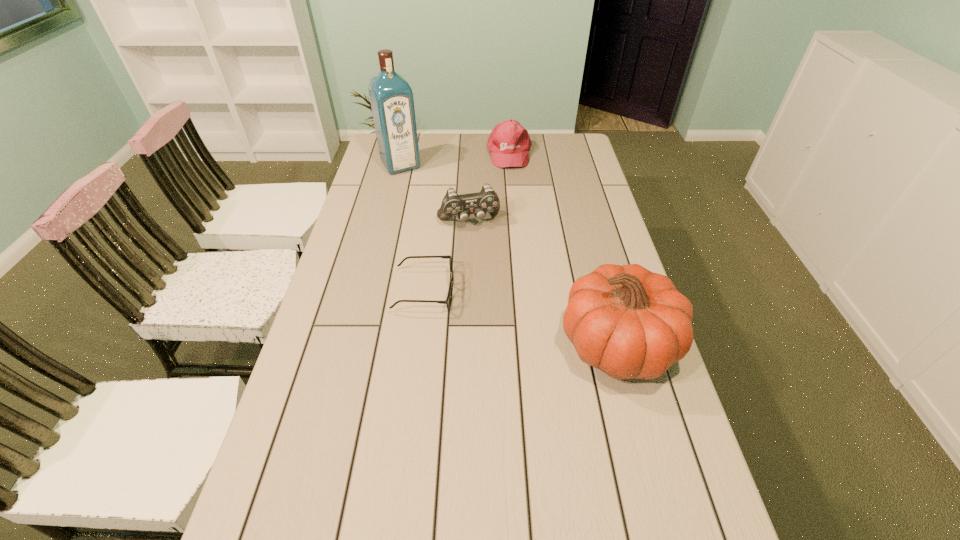
What are the coordinates of `vacant space located at the front of the baseball cap with the brim` in the screenshot? It's located at (522, 228).

Identify the location of free space located at the front of the baseball cap with the brim. The image size is (960, 540). (523, 235).

Where is `free location located on the surface of the control with buttons`? This screenshot has width=960, height=540. free location located on the surface of the control with buttons is located at coordinates click(x=490, y=274).

You are a GUI agent. You are given a task and a screenshot of the screen. Output one action in this format:
    pyautogui.click(x=<x>, y=<y>)
    Task: Click on the vacant region located on the surface of the control with buttons
    
    Given the screenshot: What is the action you would take?
    pyautogui.click(x=481, y=246)

Locate an element on the screen. The height and width of the screenshot is (540, 960). free space located 0.080m on the surface of the control with buttons is located at coordinates (481, 246).

Locate an element on the screen. This screenshot has height=540, width=960. liquor located at the far edge is located at coordinates (391, 97).

You are a GUI agent. You are given a task and a screenshot of the screen. Output one action in this format:
    pyautogui.click(x=<x>, y=<y>)
    Task: Click on the baseball cap that is at the far edge
    Image resolution: width=960 pixels, height=540 pixels.
    Given the screenshot: What is the action you would take?
    pyautogui.click(x=509, y=143)

Where is `object that is at the left edge`? This screenshot has height=540, width=960. object that is at the left edge is located at coordinates (391, 97).

At what (x,y) coordinates should I click in order to perform the action: click on object located at the right edge. Please return your answer as a coordinate pair (x, y). The height and width of the screenshot is (540, 960). Looking at the image, I should click on (628, 322).

Identify the location of object at the far left corner. This screenshot has height=540, width=960. (391, 97).